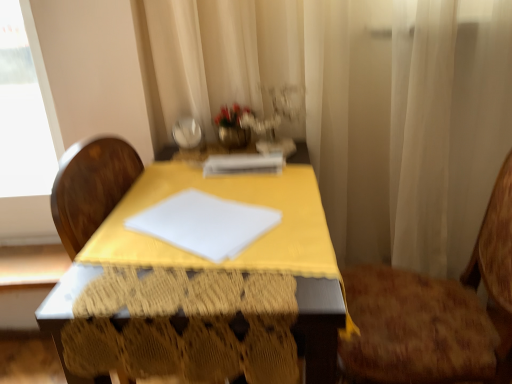
The width and height of the screenshot is (512, 384). I want to click on vacant space in front of white paper at center, so click(x=251, y=189).